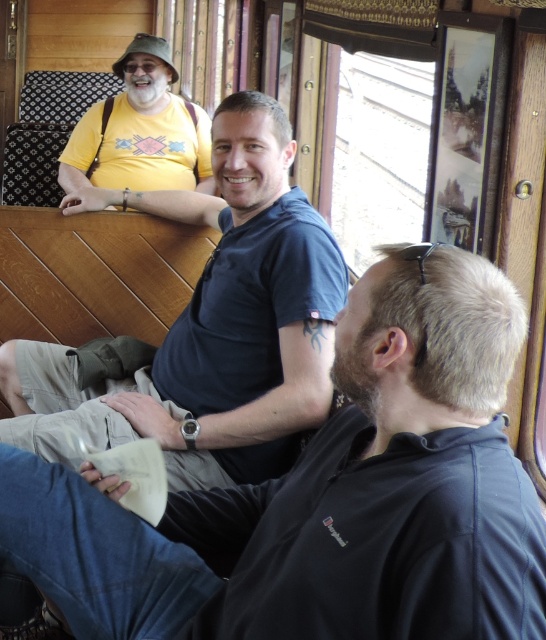
Question: Does blue cotton shirt at center appear on the right side of yellow matte shirt at upper left?

Choices:
 (A) yes
 (B) no

Answer: (A)

Question: Which object appears closest to the camera in this image?

Choices:
 (A) black matte shirt at center
 (B) blue cotton shirt at center
 (C) yellow matte shirt at upper left

Answer: (A)

Question: Is blue cotton shirt at center smaller than yellow matte shirt at upper left?

Choices:
 (A) yes
 (B) no

Answer: (B)

Question: Can you confirm if black matte shirt at center is positioned to the left of yellow matte shirt at upper left?

Choices:
 (A) no
 (B) yes

Answer: (A)

Question: Which point is closer to the camera taking this photo?

Choices:
 (A) (218, 621)
 (B) (179, 148)
 (C) (139, 388)

Answer: (A)

Question: Among these points, which one is farthest from the camera?

Choices:
 (A) coord(314,611)
 (B) coord(290,412)

Answer: (B)